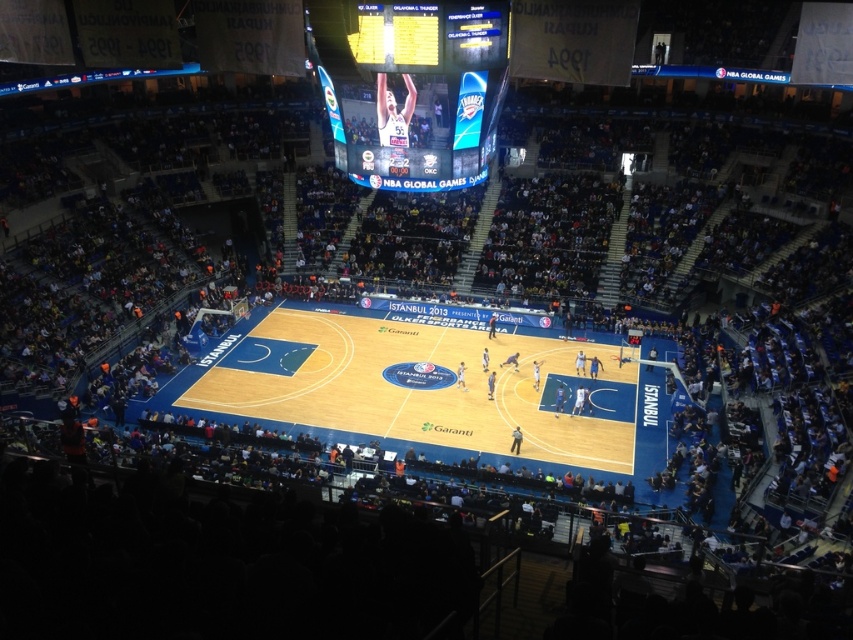
Can you confirm if shiny digital display at center is taller than matte plastic scoreboard at upper center?

Indeed, shiny digital display at center has a greater height compared to matte plastic scoreboard at upper center.

Which of these two, shiny digital display at center or matte plastic scoreboard at upper center, stands shorter?

matte plastic scoreboard at upper center is shorter.

Does point (490, 92) come behind point (421, 20)?

Yes, point (490, 92) is farther from viewer.

At what (x,y) coordinates should I click in order to perform the action: click on shiny digital display at center. Please return your answer as a coordinate pair (x, y). The image size is (853, 640). Looking at the image, I should click on (419, 93).

Is wooden at center taller than matte plastic scoreboard at upper center?

Yes.

Which is in front, point (370, 394) or point (410, 24)?

Positioned in front is point (410, 24).

Between point (332, 428) and point (409, 42), which one is positioned in front?

Positioned in front is point (409, 42).

Identify the location of wooden at center. (415, 385).

Measure the distance between point [608,374] and camera.

They are 134.44 feet apart.

Is wooden at center wider than shiny digital display at center?

Indeed, wooden at center has a greater width compared to shiny digital display at center.

Between point (296, 330) and point (500, 29), which one is positioned in front?

Point (500, 29)

Identify the location of wooden at center. (415, 385).